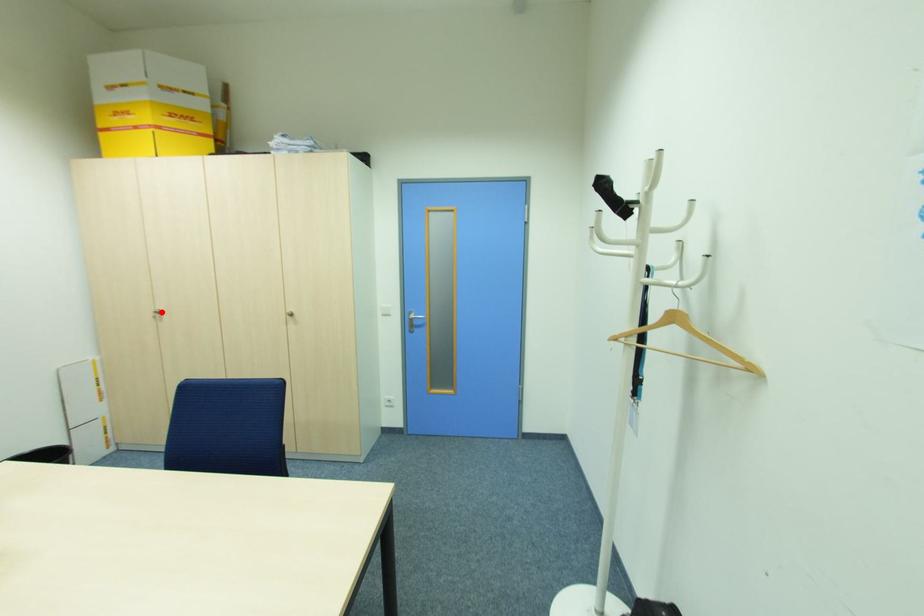
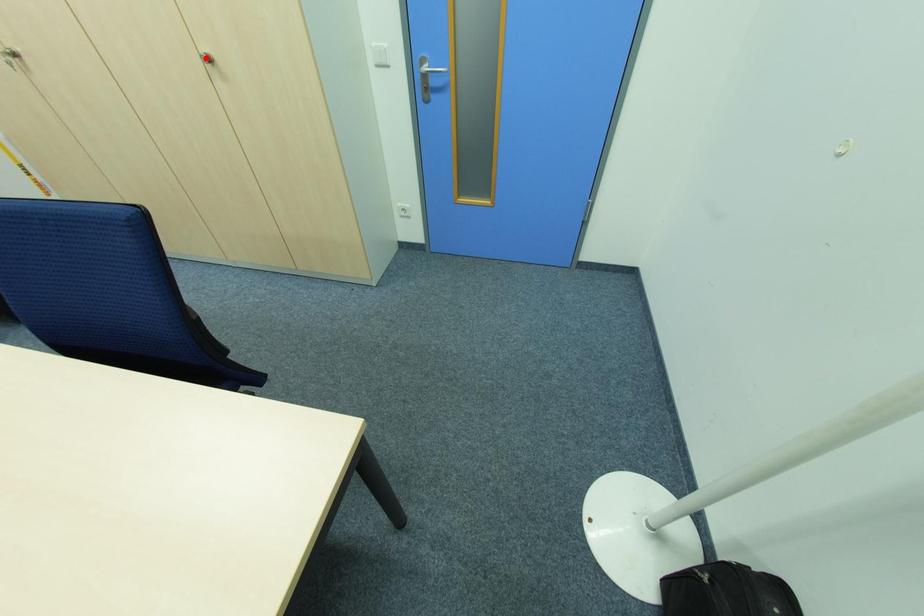
I am providing you with two images of the same scene from different viewpoints. A red point is marked on the first image and another point is marked on the second image. Is the marked point in image1 the same physical position as the marked point in image2?

No